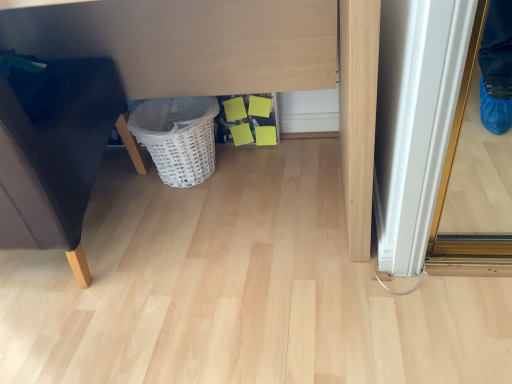
Where is `vacant space underneath matte white vanity at center (from a real-world perspective)`? The image size is (512, 384). vacant space underneath matte white vanity at center (from a real-world perspective) is located at coordinates (250, 193).